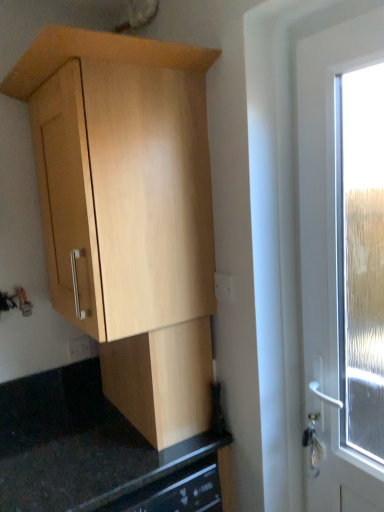
Question: Is white plastic electric outlet at center-right, positioned as the 1th electric outlet in front-to-back order, closer to camera compared to light wood cabinet at center, placed as the first cabinetry when sorted from bottom to top?

Choices:
 (A) yes
 (B) no

Answer: (B)

Question: Is white plastic electric outlet at center-right, positioned as the second electric outlet in bottom-to-top order, outside light wood cabinet at center, placed as the first cabinetry when sorted from bottom to top?

Choices:
 (A) no
 (B) yes

Answer: (B)

Question: Does white plastic electric outlet at center-right, arranged as the first electric outlet when viewed from the top, have a greater width compared to light wood cabinet at center, the second cabinetry positioned from the top?

Choices:
 (A) yes
 (B) no

Answer: (B)

Question: Is white plastic electric outlet at center-right, the second electric outlet from the back, further to the viewer compared to light wood cabinet at center, the second cabinetry positioned from the top?

Choices:
 (A) yes
 (B) no

Answer: (A)

Question: Does white plastic electric outlet at center-right, positioned as the second electric outlet in bottom-to-top order, have a larger size compared to light wood cabinet at center, placed as the first cabinetry when sorted from bottom to top?

Choices:
 (A) no
 (B) yes

Answer: (A)

Question: From a real-world perspective, does white plastic electric outlet at center-right, arranged as the first electric outlet when viewed from the top, stand above light wood cabinet at center, placed as the first cabinetry when sorted from bottom to top?

Choices:
 (A) no
 (B) yes

Answer: (B)

Question: From a real-world perspective, does light wood cabinet at upper left, marked as the 2th cabinetry in a bottom-to-top arrangement, sit lower than white plastic electric outlet at center-right, positioned as the 1th electric outlet in front-to-back order?

Choices:
 (A) no
 (B) yes

Answer: (A)

Question: Can you confirm if light wood cabinet at upper left, marked as the 2th cabinetry in a bottom-to-top arrangement, is positioned to the right of white plastic electric outlet at center-right, arranged as the first electric outlet when viewed from the top?

Choices:
 (A) yes
 (B) no

Answer: (B)

Question: Is light wood cabinet at upper left, which ranks as the 1th cabinetry in top-to-bottom order, not inside white plastic electric outlet at center-right, positioned as the second electric outlet in bottom-to-top order?

Choices:
 (A) yes
 (B) no

Answer: (A)

Question: Considering the relative sizes of light wood cabinet at upper left, which ranks as the 1th cabinetry in top-to-bottom order, and white plastic electric outlet at center-right, arranged as the first electric outlet when viewed from the top, in the image provided, is light wood cabinet at upper left, which ranks as the 1th cabinetry in top-to-bottom order, thinner than white plastic electric outlet at center-right, arranged as the first electric outlet when viewed from the top,?

Choices:
 (A) yes
 (B) no

Answer: (B)

Question: Can you confirm if light wood cabinet at upper left, which ranks as the 1th cabinetry in top-to-bottom order, is smaller than white plastic electric outlet at center-right, positioned as the 2th electric outlet in left-to-right order?

Choices:
 (A) no
 (B) yes

Answer: (A)

Question: Considering the relative sizes of light wood cabinet at upper left, marked as the 2th cabinetry in a bottom-to-top arrangement, and white plastic electric outlet at center-right, positioned as the 1th electric outlet in front-to-back order, in the image provided, is light wood cabinet at upper left, marked as the 2th cabinetry in a bottom-to-top arrangement, bigger than white plastic electric outlet at center-right, positioned as the 1th electric outlet in front-to-back order,?

Choices:
 (A) no
 (B) yes

Answer: (B)

Question: From a real-world perspective, is white plastic electric outlet at center-right, which ranks as the first electric outlet in right-to-left order, below black granite countertop at lower center?

Choices:
 (A) yes
 (B) no

Answer: (B)